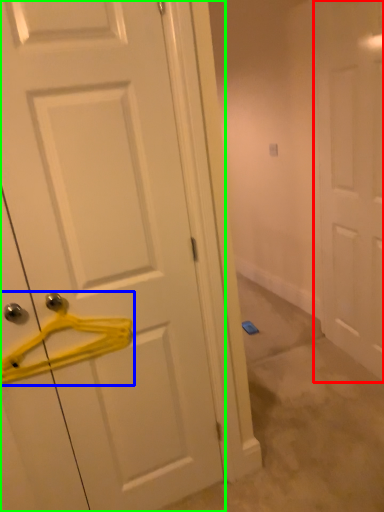
Question: Which object is the farthest from door (highlighted by a red box)? Choose among these: hanger (highlighted by a blue box) or door (highlighted by a green box).

Choices:
 (A) hanger
 (B) door

Answer: (A)